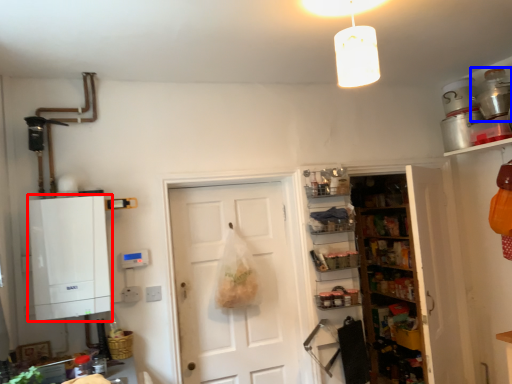
Question: Which point is further to the camera, cabinetry (highlighted by a red box) or appliance (highlighted by a blue box)?

Choices:
 (A) cabinetry
 (B) appliance

Answer: (B)